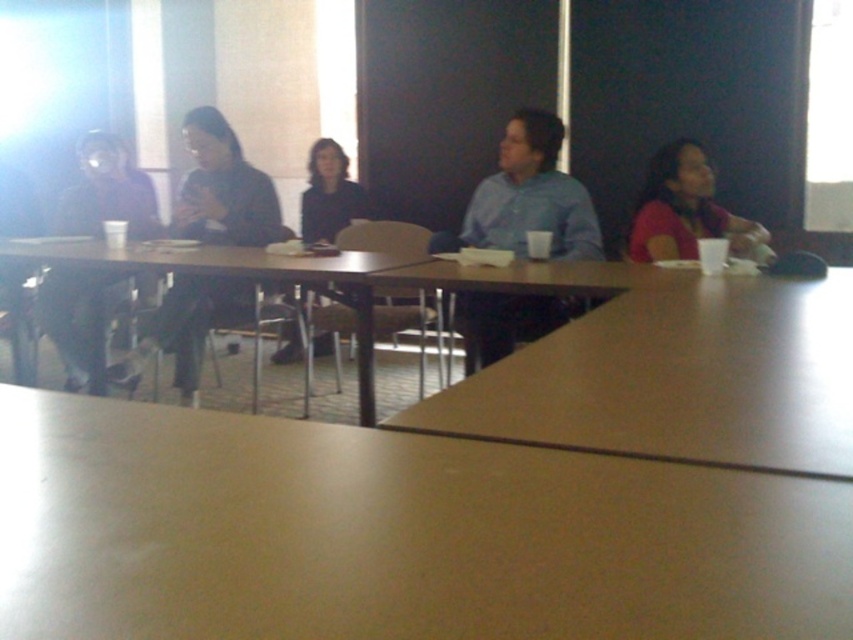
You are a person sitting at the smooth beige table at center. You want to place your matte black jacket at center on the table. Is the table tall enough to support the jacket without it dragging on the floor?

The smooth beige table at center is not as tall as matte black jacket at center, so placing the matte black jacket at center on the table would result in it dragging on the floor since the table is shorter than the jacket.

You are a person sitting at the smooth wooden table at center. You want to slide a 12 inch long notebook from your side of the table to the person sitting directly across from you. Is there enough space between you and the person sitting across for the notebook to fit without overlapping?

The distance between you and the person sitting across at the smooth wooden table at center is 34.00 inches. Since the notebook is only 12 inches long, there is ample space for it to fit without overlapping.